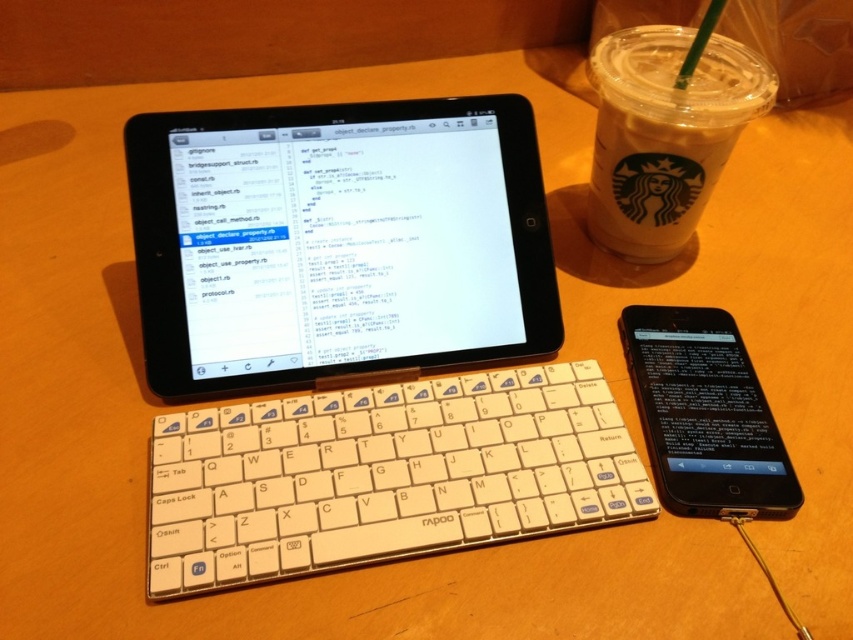
Question: Which of the following is the farthest from the observer?

Choices:
 (A) white paper cup at upper right
 (B) white plastic keyboard at center
 (C) black matte tablet at upper center

Answer: (A)

Question: Is white plastic keyboard at center above black glossy phone at center?

Choices:
 (A) yes
 (B) no

Answer: (B)

Question: Can you confirm if white plastic keyboard at center is bigger than white paper cup at upper right?

Choices:
 (A) no
 (B) yes

Answer: (B)

Question: Which object is the closest to the black matte tablet at upper center?

Choices:
 (A) white plastic keyboard at center
 (B) white paper cup at upper right
 (C) black glossy phone at center

Answer: (A)

Question: Does white plastic keyboard at center have a larger size compared to black glossy phone at center?

Choices:
 (A) no
 (B) yes

Answer: (B)

Question: Considering the real-world distances, which object is closest to the white paper cup at upper right?

Choices:
 (A) black glossy phone at center
 (B) black matte tablet at upper center
 (C) white plastic keyboard at center

Answer: (A)